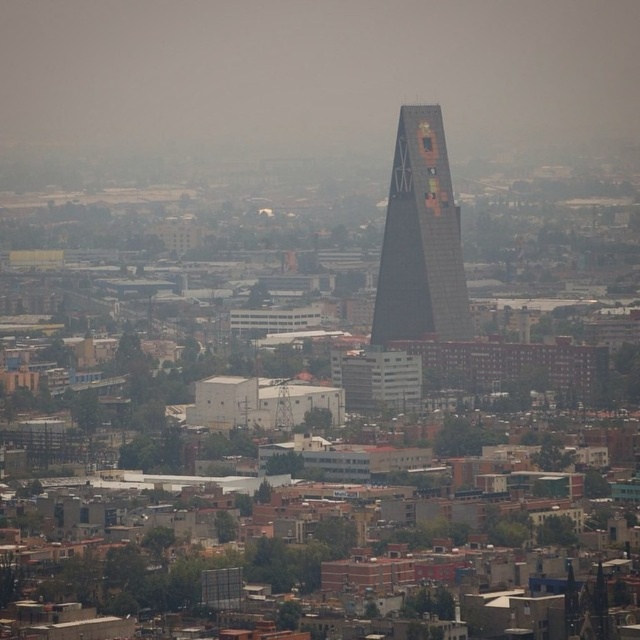
Question: Is transparent fog at center to the left of dark glass skyscraper at center from the viewer's perspective?

Choices:
 (A) yes
 (B) no

Answer: (A)

Question: Does transparent fog at center have a larger size compared to dark glass skyscraper at center?

Choices:
 (A) no
 (B) yes

Answer: (B)

Question: Which object appears closest to the camera in this image?

Choices:
 (A) transparent fog at center
 (B) dark glass skyscraper at center

Answer: (B)

Question: Is transparent fog at center to the left of dark glass skyscraper at center from the viewer's perspective?

Choices:
 (A) no
 (B) yes

Answer: (B)